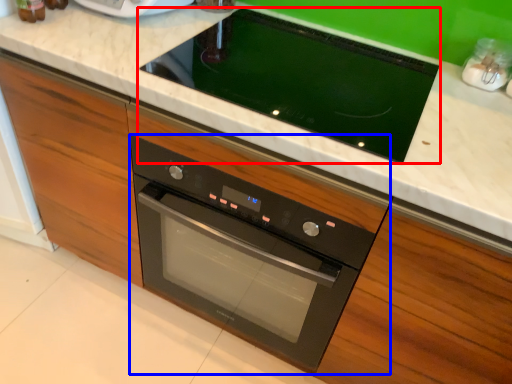
Question: Which object is further to the camera taking this photo, home appliance (highlighted by a red box) or oven (highlighted by a blue box)?

Choices:
 (A) home appliance
 (B) oven

Answer: (B)